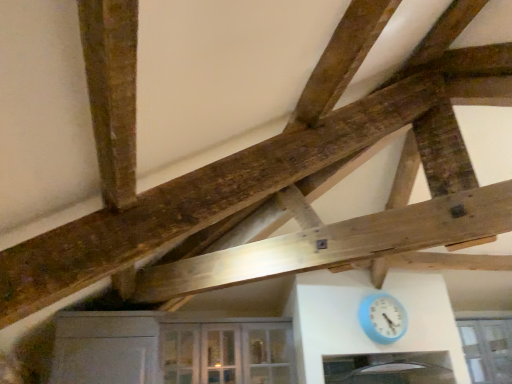
Question: Is clear glass cabinet at lower center positioned with its back to clear glass window at lower right?

Choices:
 (A) yes
 (B) no

Answer: (B)

Question: Can you confirm if clear glass cabinet at lower center is positioned to the right of clear glass window at lower right?

Choices:
 (A) no
 (B) yes

Answer: (A)

Question: Considering the relative sizes of clear glass cabinet at lower center and clear glass window at lower right in the image provided, is clear glass cabinet at lower center smaller than clear glass window at lower right?

Choices:
 (A) yes
 (B) no

Answer: (B)

Question: Does clear glass cabinet at lower center have a larger size compared to clear glass window at lower right?

Choices:
 (A) yes
 (B) no

Answer: (A)

Question: Considering the relative sizes of clear glass cabinet at lower center and clear glass window at lower right in the image provided, is clear glass cabinet at lower center thinner than clear glass window at lower right?

Choices:
 (A) no
 (B) yes

Answer: (A)

Question: Can you confirm if clear glass cabinet at lower center is wider than clear glass window at lower right?

Choices:
 (A) yes
 (B) no

Answer: (A)

Question: Considering the relative sizes of blue plastic clock at lower right and clear glass cabinet at lower center in the image provided, is blue plastic clock at lower right smaller than clear glass cabinet at lower center?

Choices:
 (A) no
 (B) yes

Answer: (B)

Question: Considering the relative sizes of blue plastic clock at lower right and clear glass cabinet at lower center in the image provided, is blue plastic clock at lower right shorter than clear glass cabinet at lower center?

Choices:
 (A) yes
 (B) no

Answer: (A)

Question: Is blue plastic clock at lower right positioned with its back to clear glass cabinet at lower center?

Choices:
 (A) yes
 (B) no

Answer: (B)

Question: Does blue plastic clock at lower right lie behind clear glass cabinet at lower center?

Choices:
 (A) yes
 (B) no

Answer: (A)

Question: Is blue plastic clock at lower right aimed at clear glass cabinet at lower center?

Choices:
 (A) no
 (B) yes

Answer: (A)

Question: From a real-world perspective, is blue plastic clock at lower right located beneath clear glass cabinet at lower center?

Choices:
 (A) no
 (B) yes

Answer: (A)

Question: Is clear glass window at lower right taller than clear glass cabinet at lower center?

Choices:
 (A) yes
 (B) no

Answer: (A)